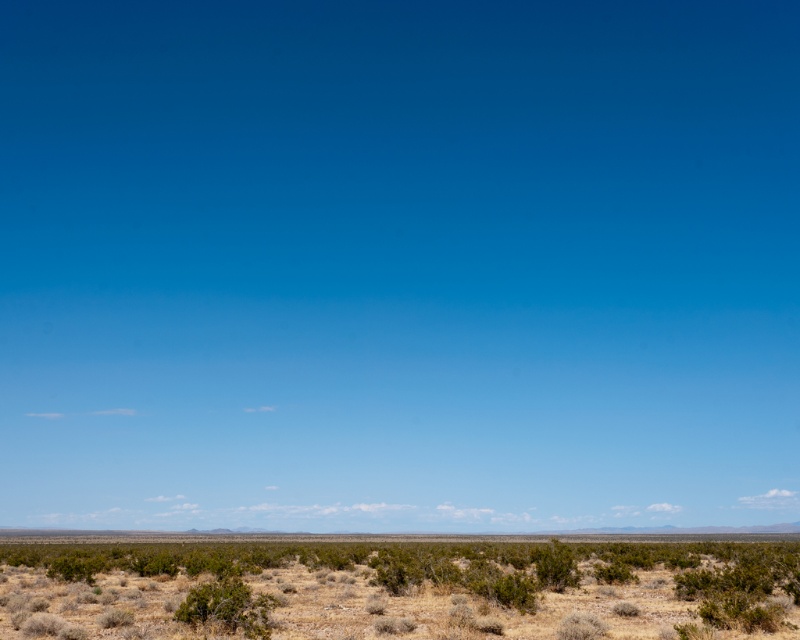
You are a desert explorer who needs to find a spot to set up camp. You see the dry shrubbery at lower center and the brown dirt at center. Which location would provide a flatter surface for your tent?

The brown dirt at center provides a flatter surface because the dry shrubbery at lower center is positioned over it, indicating the dirt is the base terrain.

You are a hiker who needs to cross the desert. You see the dry shrubbery at lower center and the brown dirt at center. How far apart are these two landmarks?

The dry shrubbery at lower center and the brown dirt at center are 163.80 feet apart from each other.

You are standing at the origin point of the desert scene. You want to walk to the dry shrubbery at lower center. What are the coordinates you need to reach?

The coordinates to reach the dry shrubbery at lower center are point (x=400, y=589).